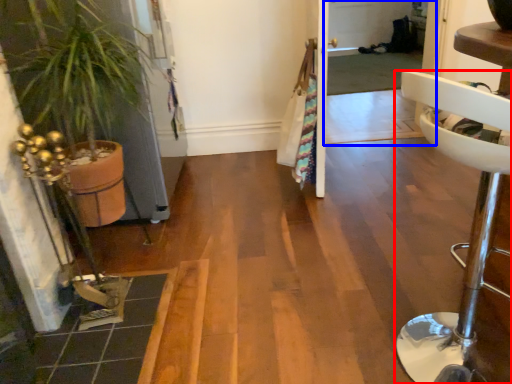
Question: Which point is closer to the camera, furniture (highlighted by a red box) or screen door (highlighted by a blue box)?

Choices:
 (A) furniture
 (B) screen door

Answer: (A)